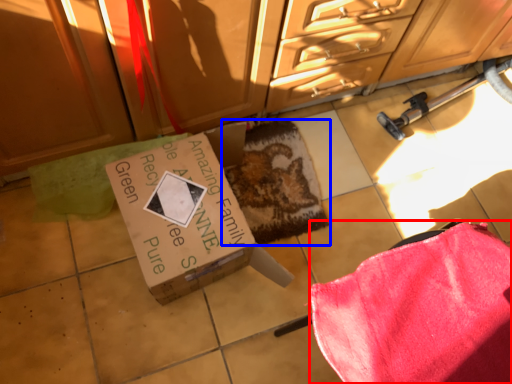
Question: Which of the following is the farthest to the observer, blanket (highlighted by a red box) or mat (highlighted by a blue box)?

Choices:
 (A) blanket
 (B) mat

Answer: (B)